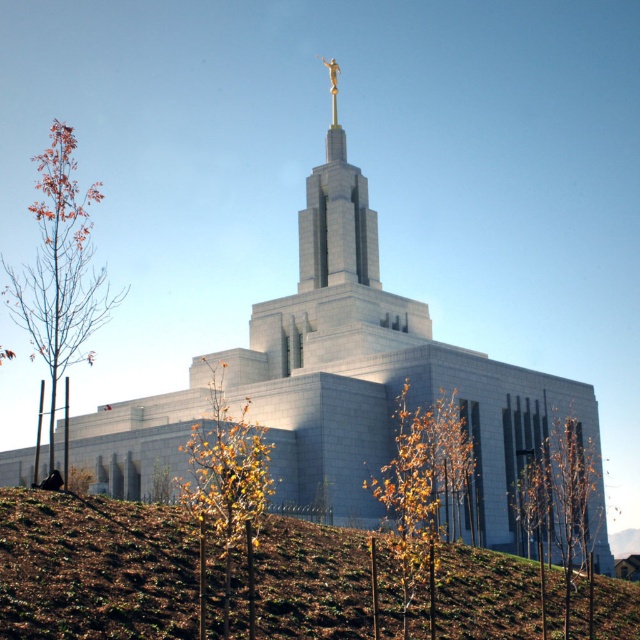
Which is above, brown soil at lower left or yellow-green leaves at lower center?

yellow-green leaves at lower center is above.

How far apart are brown soil at lower left and yellow-green leaves at lower center?

brown soil at lower left is 10.45 meters from yellow-green leaves at lower center.

The image size is (640, 640). In order to click on brown soil at lower left in this screenshot , I will do `click(93, 566)`.

The height and width of the screenshot is (640, 640). What do you see at coordinates (93, 566) in the screenshot? I see `brown soil at lower left` at bounding box center [93, 566].

Does brown soil at lower left appear over brown leafy tree at lower right?

Yes.

Where is `brown soil at lower left`? The width and height of the screenshot is (640, 640). brown soil at lower left is located at coordinates (93, 566).

Where is `brown soil at lower left`? This screenshot has width=640, height=640. brown soil at lower left is located at coordinates (93, 566).

Does yellow-green foliage at center have a lesser width compared to brown leafy tree at lower right?

Correct, yellow-green foliage at center's width is less than brown leafy tree at lower right's.

Is yellow-green foliage at center shorter than brown leafy tree at lower right?

Yes, yellow-green foliage at center is shorter than brown leafy tree at lower right.

What do you see at coordinates (422, 486) in the screenshot? I see `yellow-green foliage at center` at bounding box center [422, 486].

The height and width of the screenshot is (640, 640). In order to click on yellow-green foliage at center in this screenshot , I will do `click(422, 486)`.